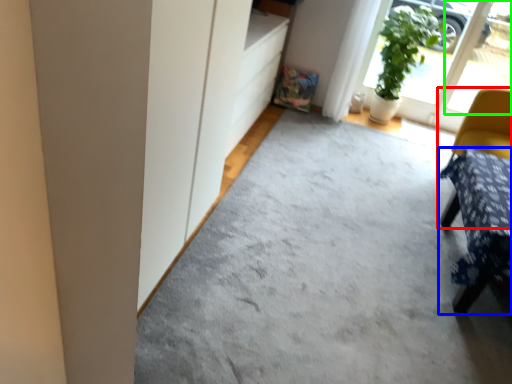
Question: Considering the real-world distances, which object is closest to chair (highlighted by a red box)? furniture (highlighted by a blue box) or window (highlighted by a green box).

Choices:
 (A) furniture
 (B) window

Answer: (A)